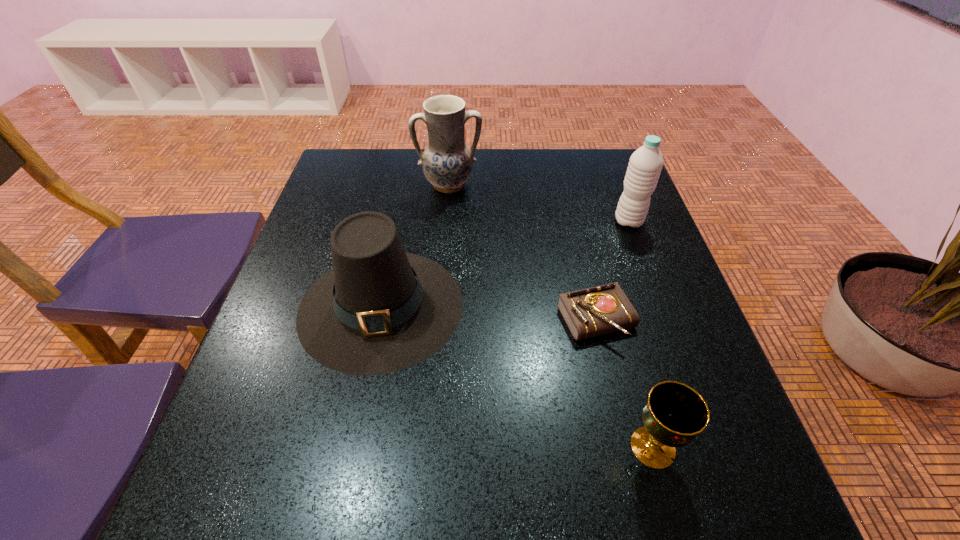
Image resolution: width=960 pixels, height=540 pixels. I want to click on vacant space at the near edge of the desktop, so click(642, 473).

Identify the location of vacant space at the left edge of the desktop. (266, 388).

In the image, there is a desktop. Where is `vacant space at the right edge`? The width and height of the screenshot is (960, 540). vacant space at the right edge is located at coordinates (651, 312).

Image resolution: width=960 pixels, height=540 pixels. I want to click on vacant space at the far left corner, so click(368, 188).

I want to click on vacant region at the far right corner of the desktop, so click(x=625, y=161).

In the image, there is a desktop. Identify the location of free space at the near right corner. The width and height of the screenshot is (960, 540). (678, 523).

The image size is (960, 540). Identify the location of unoccupied position between the pottery and the rightmost object. (539, 203).

This screenshot has width=960, height=540. Identify the location of vacant space in between the pottery and the rightmost object. (539, 203).

In order to click on empty location between the farthest object and the chalice in this screenshot , I will do `click(551, 316)`.

The image size is (960, 540). What are the coordinates of `vacant region between the fourth tallest object and the hat` in the screenshot? It's located at (517, 376).